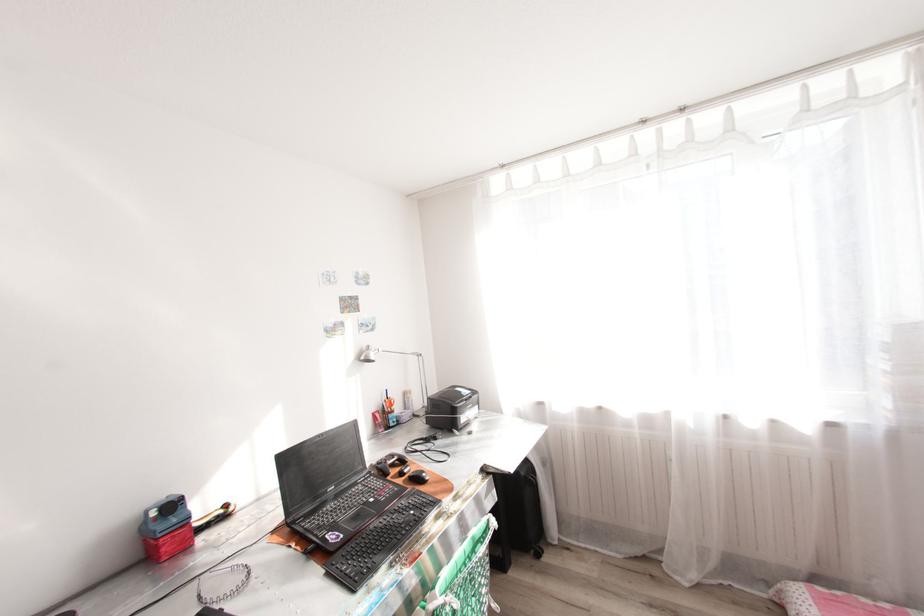
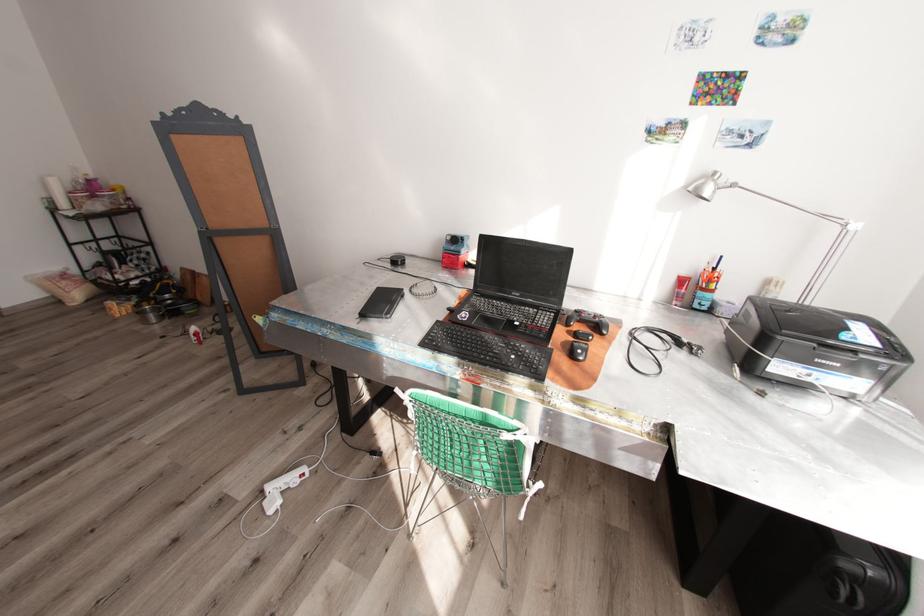
Where in the second image is the point corresponding to point (429, 474) from the first image?

(584, 351)